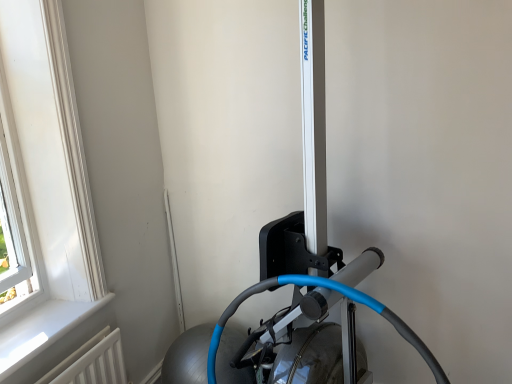
Question: Which direction should I rotate to look at silver metallic rowing machine at center, the second sport equipment ordered from the bottom, — up or down?

Choices:
 (A) down
 (B) up

Answer: (A)

Question: Is silver metallic rowing machine at center, arranged as the 1th sport equipment when viewed from the top, at the right side of black rubber rowing machine at center, which is the first sport equipment from bottom to top?

Choices:
 (A) no
 (B) yes

Answer: (A)

Question: Would you say silver metallic rowing machine at center, arranged as the 1th sport equipment when viewed from the top, contains black rubber rowing machine at center, the 2th sport equipment positioned from the top?

Choices:
 (A) no
 (B) yes

Answer: (B)

Question: Is silver metallic rowing machine at center, the second sport equipment ordered from the bottom, thinner than black rubber rowing machine at center, the 2th sport equipment positioned from the top?

Choices:
 (A) yes
 (B) no

Answer: (B)

Question: Is silver metallic rowing machine at center, the second sport equipment ordered from the bottom, facing away from black rubber rowing machine at center, which is the first sport equipment from bottom to top?

Choices:
 (A) no
 (B) yes

Answer: (A)

Question: Does silver metallic rowing machine at center, the second sport equipment ordered from the bottom, have a smaller size compared to black rubber rowing machine at center, which is the first sport equipment from bottom to top?

Choices:
 (A) no
 (B) yes

Answer: (A)

Question: Does silver metallic rowing machine at center, the second sport equipment ordered from the bottom, appear on the left side of black rubber rowing machine at center, the 2th sport equipment positioned from the top?

Choices:
 (A) yes
 (B) no

Answer: (A)

Question: Is white plastic window at upper left to the left of silver metallic rowing machine at center, arranged as the 1th sport equipment when viewed from the top, from the viewer's perspective?

Choices:
 (A) yes
 (B) no

Answer: (A)

Question: From the image's perspective, is white plastic window at upper left located above silver metallic rowing machine at center, arranged as the 1th sport equipment when viewed from the top?

Choices:
 (A) no
 (B) yes

Answer: (B)

Question: Is white plastic window at upper left oriented away from silver metallic rowing machine at center, arranged as the 1th sport equipment when viewed from the top?

Choices:
 (A) yes
 (B) no

Answer: (B)

Question: Can you confirm if white plastic window at upper left is wider than silver metallic rowing machine at center, arranged as the 1th sport equipment when viewed from the top?

Choices:
 (A) no
 (B) yes

Answer: (A)

Question: Is white plastic window at upper left next to silver metallic rowing machine at center, arranged as the 1th sport equipment when viewed from the top, and touching it?

Choices:
 (A) yes
 (B) no

Answer: (B)

Question: Considering the relative sizes of white plastic window at upper left and silver metallic rowing machine at center, the second sport equipment ordered from the bottom, in the image provided, is white plastic window at upper left thinner than silver metallic rowing machine at center, the second sport equipment ordered from the bottom,?

Choices:
 (A) yes
 (B) no

Answer: (A)

Question: Does white plastic window at upper left have a greater width compared to black rubber rowing machine at center, which is the first sport equipment from bottom to top?

Choices:
 (A) yes
 (B) no

Answer: (B)